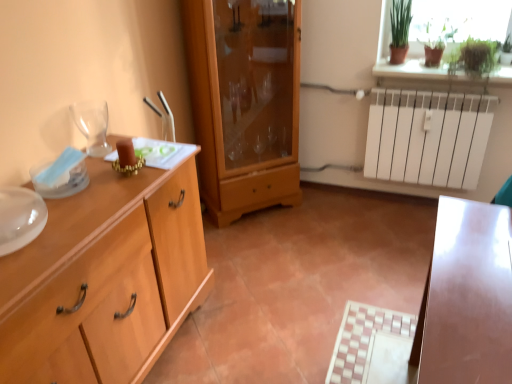
Question: Is green matte plant at upper right surrounded by light wood chest of drawers at left?

Choices:
 (A) no
 (B) yes

Answer: (A)

Question: Is light wood chest of drawers at left smaller than green matte plant at upper right?

Choices:
 (A) no
 (B) yes

Answer: (A)

Question: Is light wood chest of drawers at left shorter than green matte plant at upper right?

Choices:
 (A) yes
 (B) no

Answer: (B)

Question: Can you confirm if light wood chest of drawers at left is thinner than green matte plant at upper right?

Choices:
 (A) yes
 (B) no

Answer: (B)

Question: Could you tell me if light wood chest of drawers at left is facing green matte plant at upper right?

Choices:
 (A) yes
 (B) no

Answer: (B)

Question: In terms of width, does wooden cabinet at center look wider or thinner when compared to green glass vase at upper right?

Choices:
 (A) wide
 (B) thin

Answer: (A)

Question: Considering the positions of wooden cabinet at center and green glass vase at upper right in the image, is wooden cabinet at center taller or shorter than green glass vase at upper right?

Choices:
 (A) tall
 (B) short

Answer: (A)

Question: Relative to green glass vase at upper right, is wooden cabinet at center in front or behind?

Choices:
 (A) front
 (B) behind

Answer: (A)

Question: Considering the relative positions of wooden cabinet at center and green glass vase at upper right in the image provided, is wooden cabinet at center to the left or to the right of green glass vase at upper right?

Choices:
 (A) left
 (B) right

Answer: (A)

Question: Is wooden cabinet at center in front of or behind green matte plant at upper right in the image?

Choices:
 (A) front
 (B) behind

Answer: (A)

Question: Is point (221, 183) positioned closer to the camera than point (463, 49)?

Choices:
 (A) closer
 (B) farther

Answer: (B)

Question: Considering the positions of wooden cabinet at center and green matte plant at upper right in the image, is wooden cabinet at center wider or thinner than green matte plant at upper right?

Choices:
 (A) thin
 (B) wide

Answer: (B)

Question: Looking at the image, does wooden cabinet at center seem bigger or smaller compared to green matte plant at upper right?

Choices:
 (A) big
 (B) small

Answer: (A)

Question: From the image's perspective, relative to wooden cabinet at center, is light wood chest of drawers at left above or below?

Choices:
 (A) below
 (B) above

Answer: (A)

Question: Considering the positions of light wood chest of drawers at left and wooden cabinet at center in the image, is light wood chest of drawers at left wider or thinner than wooden cabinet at center?

Choices:
 (A) wide
 (B) thin

Answer: (A)